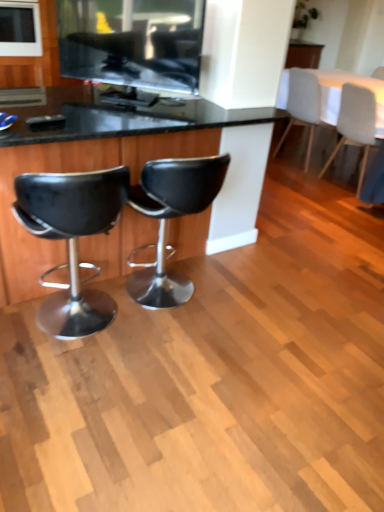
Question: Does white glossy microwave at upper left, the 2th appliance ordered from the bottom, have a greater height compared to matte black tv at upper center, the first appliance in the front-to-back sequence?

Choices:
 (A) yes
 (B) no

Answer: (A)

Question: Is white glossy microwave at upper left, the second appliance viewed from the front, at the right side of matte black tv at upper center, the first appliance when ordered from bottom to top?

Choices:
 (A) yes
 (B) no

Answer: (B)

Question: From the image's perspective, is white glossy microwave at upper left, which appears as the first appliance when viewed from the left, located beneath matte black tv at upper center, positioned as the second appliance in top-to-bottom order?

Choices:
 (A) no
 (B) yes

Answer: (A)

Question: From a real-world perspective, does white glossy microwave at upper left, placed as the first appliance when sorted from top to bottom, stand above matte black tv at upper center, which appears as the second appliance when viewed from the back?

Choices:
 (A) yes
 (B) no

Answer: (B)

Question: Can you confirm if white glossy microwave at upper left, the 2th appliance ordered from the bottom, is thinner than matte black tv at upper center, the 2th appliance viewed from the left?

Choices:
 (A) yes
 (B) no

Answer: (B)

Question: From the image's perspective, is black leather stool at left, which is the 4th chair from back to front, above or below white fabric chair at upper right, the first chair from the back?

Choices:
 (A) below
 (B) above

Answer: (A)

Question: Based on their positions, is black leather stool at left, the fourth chair from the right, located to the left or right of white fabric chair at upper right, which appears as the third chair when viewed from the left?

Choices:
 (A) right
 (B) left

Answer: (B)

Question: Is point (57, 311) positioned closer to the camera than point (291, 88)?

Choices:
 (A) farther
 (B) closer

Answer: (B)

Question: In terms of size, does black leather stool at left, the fourth chair from the right, appear bigger or smaller than white fabric chair at upper right, the first chair from the back?

Choices:
 (A) small
 (B) big

Answer: (A)

Question: In terms of size, does white fabric table at upper right appear bigger or smaller than matte black tv at upper center, the 2th appliance viewed from the left?

Choices:
 (A) big
 (B) small

Answer: (A)

Question: Is white fabric table at upper right wider or thinner than matte black tv at upper center, positioned as the second appliance in top-to-bottom order?

Choices:
 (A) thin
 (B) wide

Answer: (B)

Question: Relative to matte black tv at upper center, positioned as the second appliance in top-to-bottom order, is white fabric table at upper right in front or behind?

Choices:
 (A) behind
 (B) front

Answer: (A)

Question: From a real-world perspective, relative to matte black tv at upper center, positioned as the second appliance in top-to-bottom order, is white fabric table at upper right vertically above or below?

Choices:
 (A) below
 (B) above

Answer: (A)

Question: Is white glossy microwave at upper left, placed as the first appliance when sorted from top to bottom, wider or thinner than black leather desk at center?

Choices:
 (A) thin
 (B) wide

Answer: (A)

Question: Considering the positions of point (6, 12) and point (67, 134), is point (6, 12) closer or farther from the camera than point (67, 134)?

Choices:
 (A) closer
 (B) farther

Answer: (B)